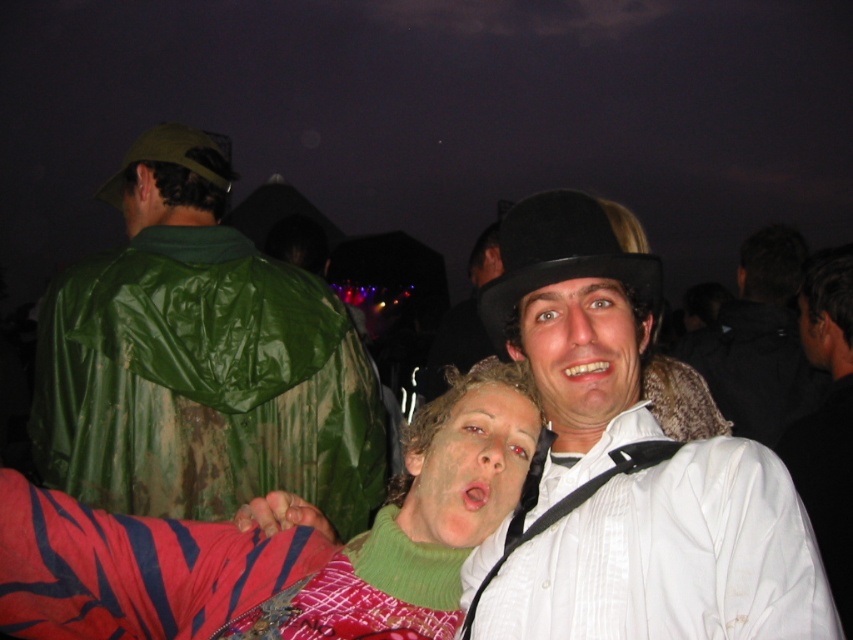
Question: Which point is closer to the camera?

Choices:
 (A) (509, 250)
 (B) (692, 333)
 (C) (509, 438)
 (D) (207, 141)

Answer: (A)

Question: Is white glossy shirt at right thinner than green knit sweater at center?

Choices:
 (A) yes
 (B) no

Answer: (B)

Question: Which point appears closest to the camera in this image?

Choices:
 (A) (659, 292)
 (B) (512, 392)
 (C) (572, 420)
 (D) (242, 465)

Answer: (C)

Question: Does white matte bowler hat at upper center come behind smooth skin face at center?

Choices:
 (A) yes
 (B) no

Answer: (B)

Question: Can you confirm if white matte bowler hat at upper center is positioned to the left of green fabric hat at upper left?

Choices:
 (A) yes
 (B) no

Answer: (B)

Question: Which point is farther from the camera taking this photo?

Choices:
 (A) (809, 346)
 (B) (426, 486)
 (C) (96, 195)

Answer: (C)